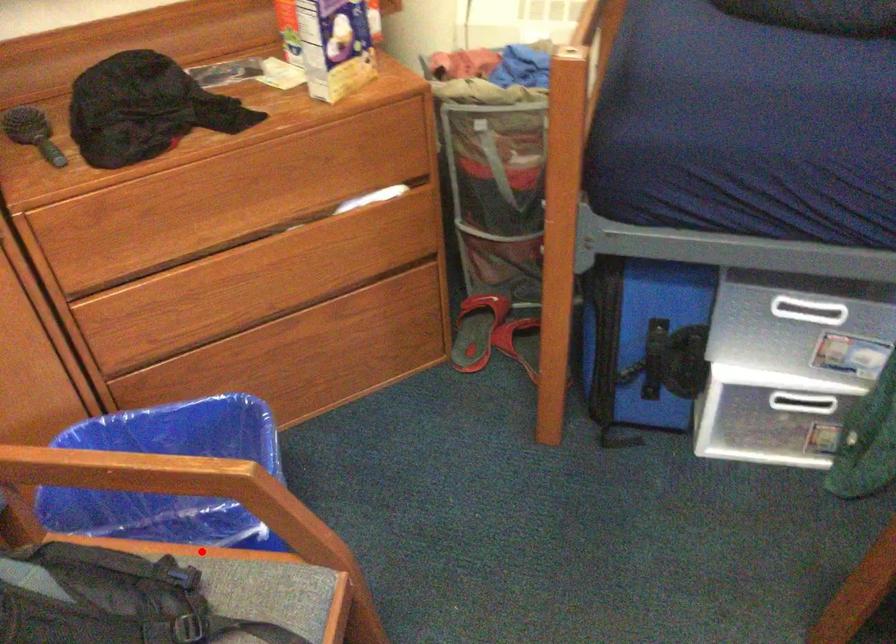
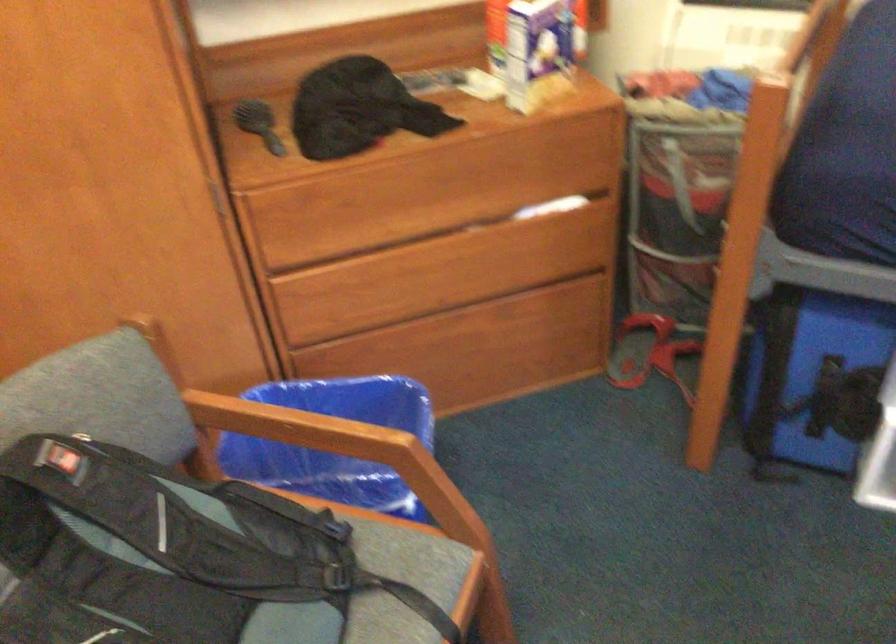
Find the pixel in the second image that matches the highlighted location in the first image.

(352, 514)